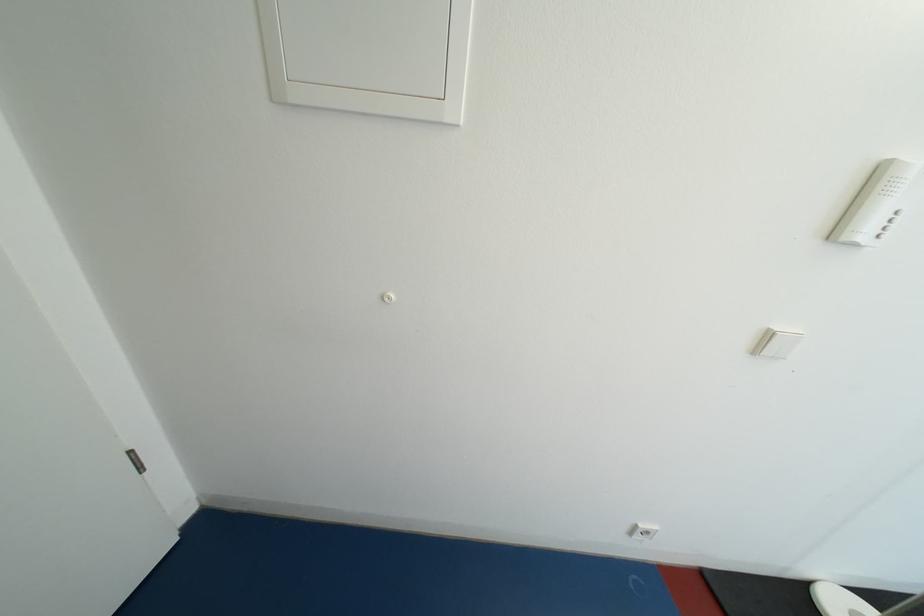
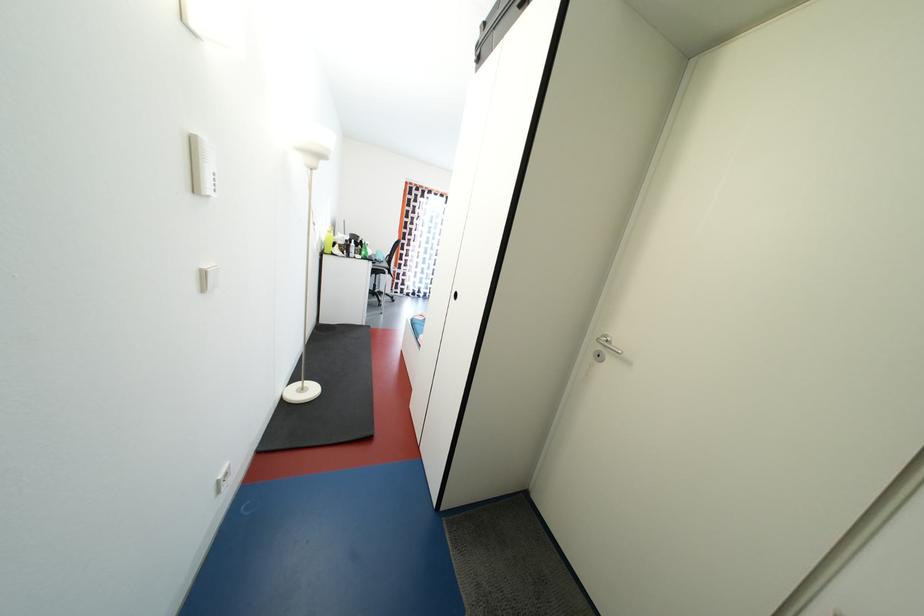
The first image is from the beginning of the video and the second image is from the end. How did the camera likely rotate when shooting the video?

The rotation direction of the camera is right-down.